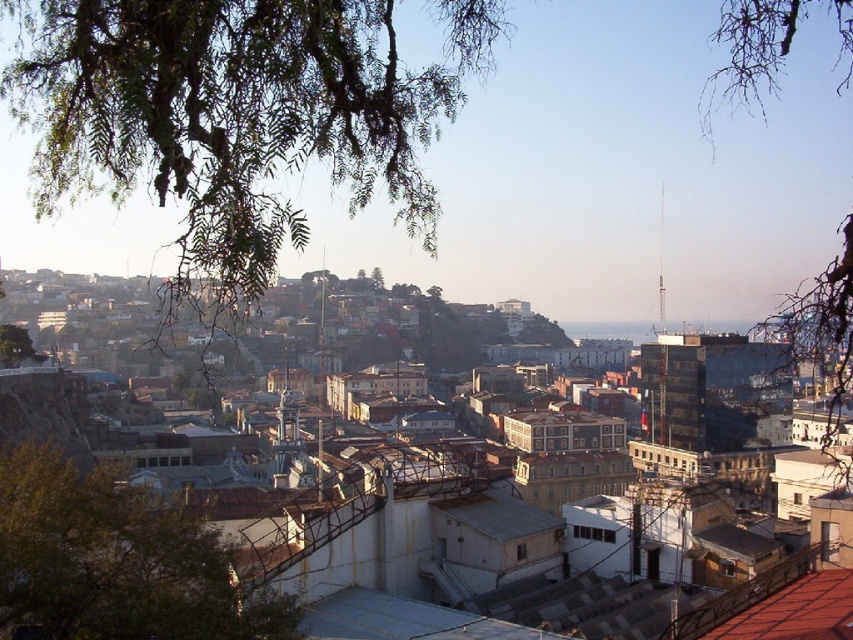
You are standing at the center of the image and want to locate the green leafy tree at lower left. According to the 2D coordinates provided, in which direction should you look to find it?

The green leafy tree at lower left is located at coordinates point (113, 563), so you should look to the lower left direction to find it.

You are a city planner reviewing this urban area. You need to determine which of the two trees, the green leafy tree at lower left or the bare branches at upper left, requires more space for growth. Based on the scene, which one would you prioritize for space allocation?

The green leafy tree at lower left has a smaller size compared to the bare branches at upper left, so the bare branches at upper left would require more space for growth and should be prioritized for space allocation.